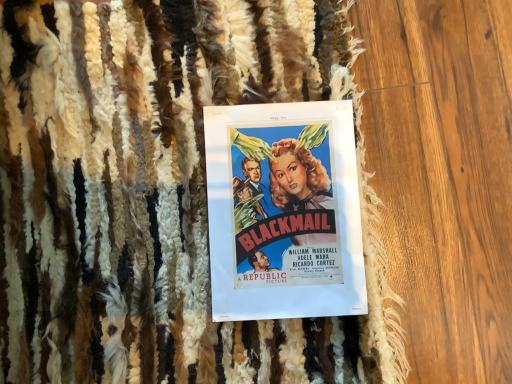
Where is `free spot in front of vivid paper poster at center`? free spot in front of vivid paper poster at center is located at coordinates (251, 344).